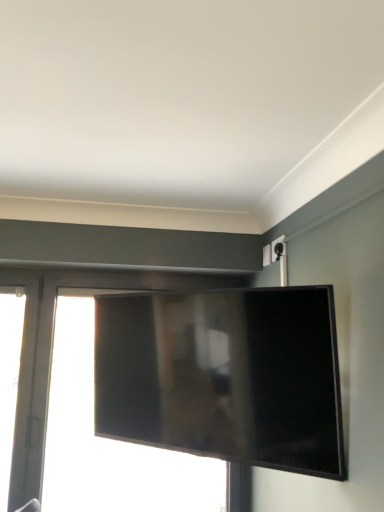
Question: Considering the relative sizes of transparent glass window at left, marked as the first window in a left-to-right arrangement, and transparent glass window at center, arranged as the first window when viewed from the right, in the image provided, is transparent glass window at left, marked as the first window in a left-to-right arrangement, wider than transparent glass window at center, arranged as the first window when viewed from the right,?

Choices:
 (A) no
 (B) yes

Answer: (A)

Question: Is transparent glass window at left, marked as the first window in a left-to-right arrangement, turned away from transparent glass window at center, which appears as the second window when viewed from the left?

Choices:
 (A) no
 (B) yes

Answer: (A)

Question: Would you say transparent glass window at left, marked as the first window in a left-to-right arrangement, is a long distance from transparent glass window at center, arranged as the first window when viewed from the right?

Choices:
 (A) no
 (B) yes

Answer: (A)

Question: Is transparent glass window at left, marked as the first window in a left-to-right arrangement, located outside transparent glass window at center, arranged as the first window when viewed from the right?

Choices:
 (A) no
 (B) yes

Answer: (B)

Question: From a real-world perspective, is transparent glass window at left, which is the second window from right to left, below transparent glass window at center, which appears as the second window when viewed from the left?

Choices:
 (A) yes
 (B) no

Answer: (B)

Question: Is transparent glass window at left, marked as the first window in a left-to-right arrangement, smaller than transparent glass window at center, which appears as the second window when viewed from the left?

Choices:
 (A) no
 (B) yes

Answer: (B)

Question: Can transparent glass window at left, marked as the first window in a left-to-right arrangement, be found inside matte black tv at center?

Choices:
 (A) yes
 (B) no

Answer: (B)

Question: Is matte black tv at center positioned behind transparent glass window at left, which is the second window from right to left?

Choices:
 (A) yes
 (B) no

Answer: (B)

Question: Can you confirm if matte black tv at center is shorter than transparent glass window at left, marked as the first window in a left-to-right arrangement?

Choices:
 (A) no
 (B) yes

Answer: (B)

Question: Could you tell me if matte black tv at center is turned towards transparent glass window at left, which is the second window from right to left?

Choices:
 (A) no
 (B) yes

Answer: (A)

Question: Is matte black tv at center wider than transparent glass window at left, which is the second window from right to left?

Choices:
 (A) yes
 (B) no

Answer: (A)

Question: Considering the relative sizes of matte black tv at center and transparent glass window at left, which is the second window from right to left, in the image provided, is matte black tv at center taller than transparent glass window at left, which is the second window from right to left,?

Choices:
 (A) no
 (B) yes

Answer: (A)

Question: Considering the relative sizes of transparent glass window at center, arranged as the first window when viewed from the right, and transparent glass window at left, which is the second window from right to left, in the image provided, is transparent glass window at center, arranged as the first window when viewed from the right, smaller than transparent glass window at left, which is the second window from right to left,?

Choices:
 (A) yes
 (B) no

Answer: (B)